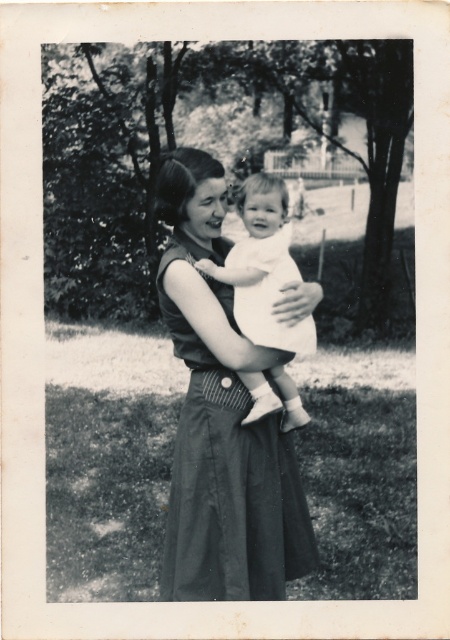
Between matte black dress at center and white cotton dress at center, which one has less height?

Standing shorter between the two is white cotton dress at center.

Who is more distant from viewer, (187, 180) or (243, 260)?

The point (243, 260) is behind.

The width and height of the screenshot is (450, 640). Describe the element at coordinates (220, 417) in the screenshot. I see `matte black dress at center` at that location.

At what (x,y) coordinates should I click in order to perform the action: click on matte black dress at center. Please return your answer as a coordinate pair (x, y). This screenshot has height=640, width=450. Looking at the image, I should click on (220, 417).

Which is behind, point (49, 483) or point (250, 420)?

The point (49, 483) is behind.

Which is above, grassy lawn at center or white clothed baby at center?

grassy lawn at center

What are the coordinates of `grassy lawn at center` in the screenshot? It's located at (103, 360).

At what (x,y) coordinates should I click in order to perform the action: click on grassy lawn at center. Please return your answer as a coordinate pair (x, y). This screenshot has width=450, height=640. Looking at the image, I should click on (103, 360).

Who is taller, matte black dress at center or white clothed baby at center?

Standing taller between the two is matte black dress at center.

Does matte black dress at center appear under white clothed baby at center?

Correct, matte black dress at center is located below white clothed baby at center.

Locate an element on the screen. The image size is (450, 640). matte black dress at center is located at coordinates (220, 417).